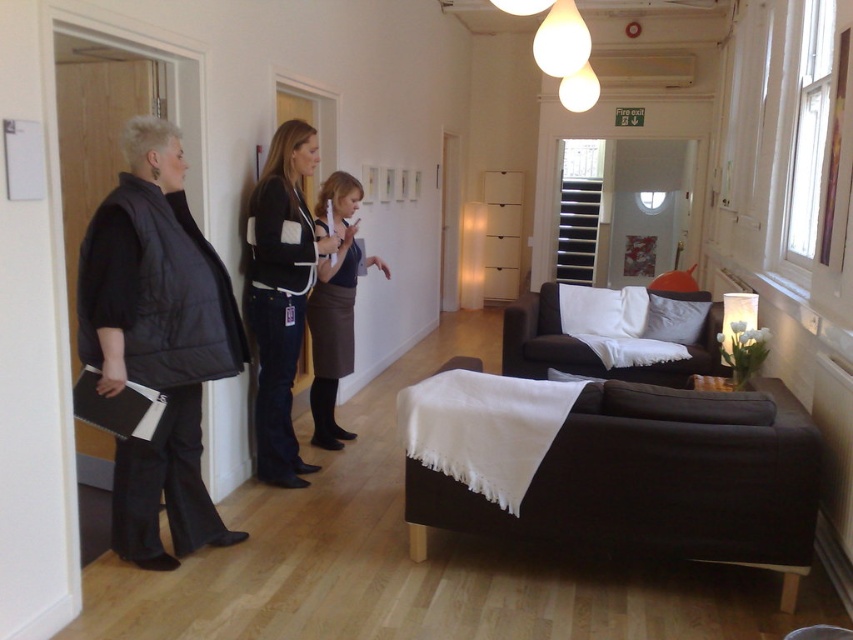
You are standing at the entrance of the room and want to approach the person wearing the black puffer vest at left. According to the coordinates provided, where should you walk towards?

The black puffer vest at left is located at coordinates point (157,342), so you should walk towards that coordinate point to reach the person wearing it.

You are standing at point (x=345, y=225) and want to walk to the entrance of the room. Which direction should you move relative to point (x=113, y=378)?

You should move towards point (x=113, y=378) because it is in front of point (x=345, y=225), meaning it is closer to the entrance.

You are standing at the entrance of the room and want to place a small plant on the closest object to you between the black denim jacket at center and the black fabric couch at center. Which object should you choose?

The black denim jacket at center is closer to the viewer than the black fabric couch at center, so you should place the small plant on the black denim jacket at center.